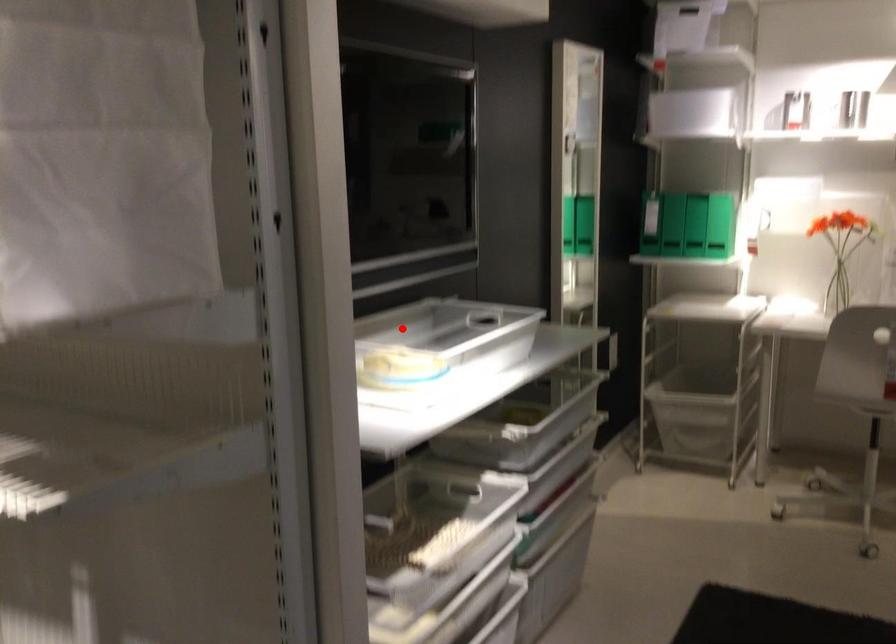
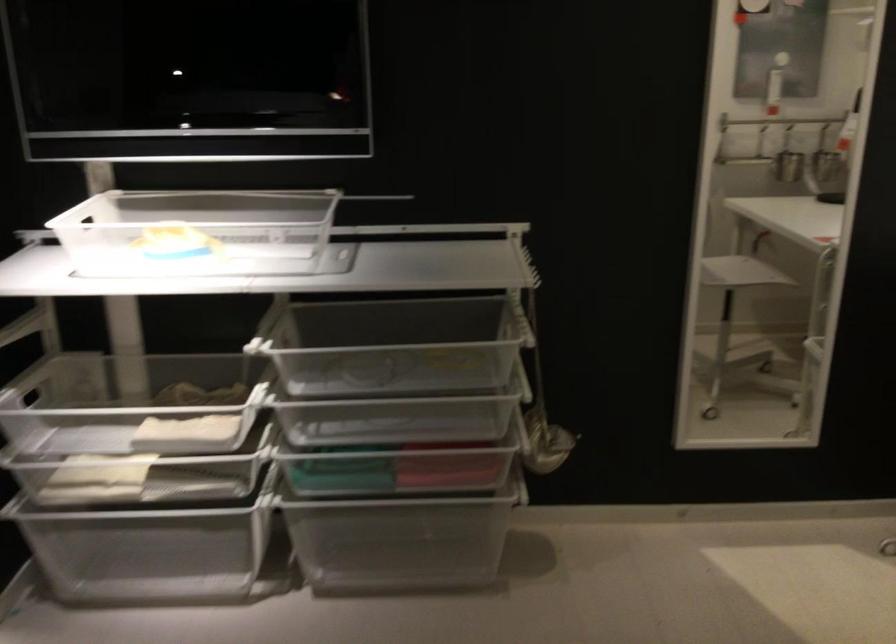
Find the pixel in the second image that matches the highlighted location in the first image.

(197, 232)